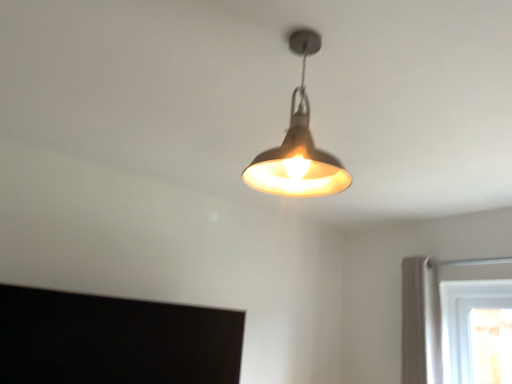
Question: Considering the positions of white fabric curtain at right and matte silver lampshade at center in the image, is white fabric curtain at right taller or shorter than matte silver lampshade at center?

Choices:
 (A) short
 (B) tall

Answer: (B)

Question: Considering their positions, is white fabric curtain at right located in front of or behind matte silver lampshade at center?

Choices:
 (A) front
 (B) behind

Answer: (B)

Question: From a real-world perspective, relative to matte silver lampshade at center, is white fabric curtain at right vertically above or below?

Choices:
 (A) below
 (B) above

Answer: (A)

Question: From their relative heights in the image, would you say matte silver lampshade at center is taller or shorter than white fabric curtain at right?

Choices:
 (A) tall
 (B) short

Answer: (B)

Question: From a real-world perspective, relative to white fabric curtain at right, is matte silver lampshade at center vertically above or below?

Choices:
 (A) below
 (B) above

Answer: (B)

Question: Is matte silver lampshade at center bigger or smaller than white fabric curtain at right?

Choices:
 (A) small
 (B) big

Answer: (A)

Question: From the image's perspective, is matte silver lampshade at center located above or below white fabric curtain at right?

Choices:
 (A) below
 (B) above

Answer: (B)